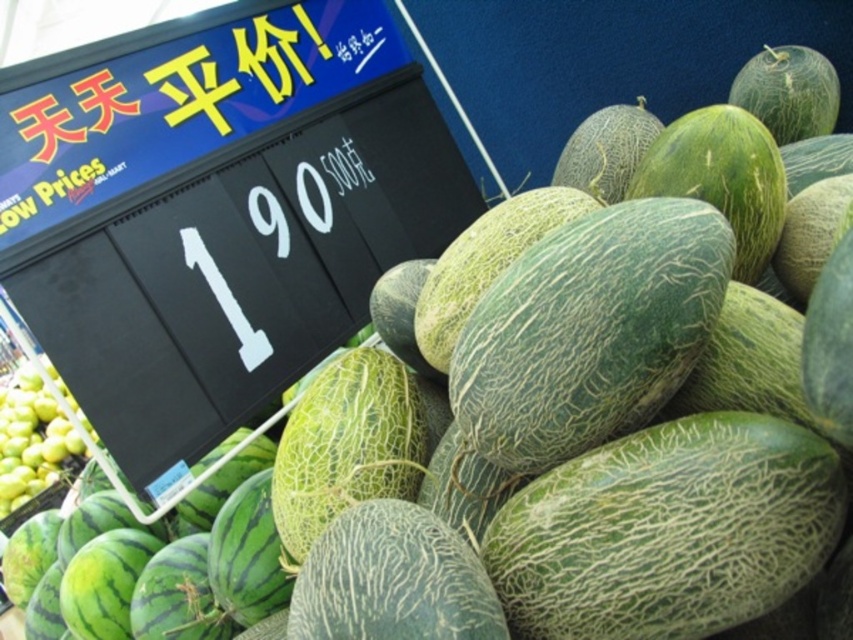
You are a customer at the market and want to pick up both the green textured melon at center and the green matte apples at lower left. If you can only carry items within a 6 feet reach, can you grab both without moving your position?

The green textured melon at center and green matte apples at lower left are 6.14 feet apart, which is slightly beyond your 6 feet reach. You cannot grab both without moving your position.

Looking at this image, you are at a fruit market and want to buy apples. You see the black plastic signboard at upper left and the green matte apples at lower left. Which item is bigger in size?

The black plastic signboard at upper left is larger in size than the green matte apples at lower left.